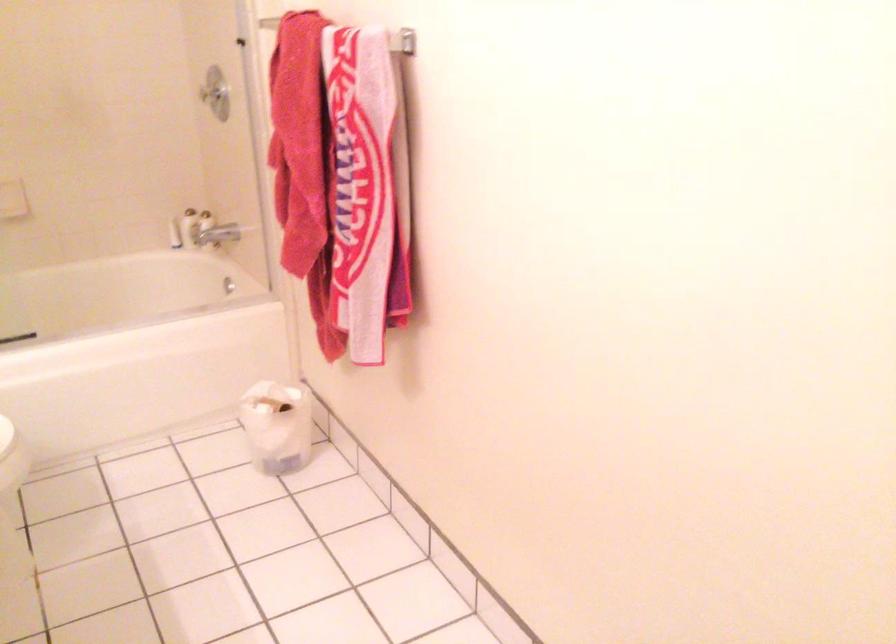
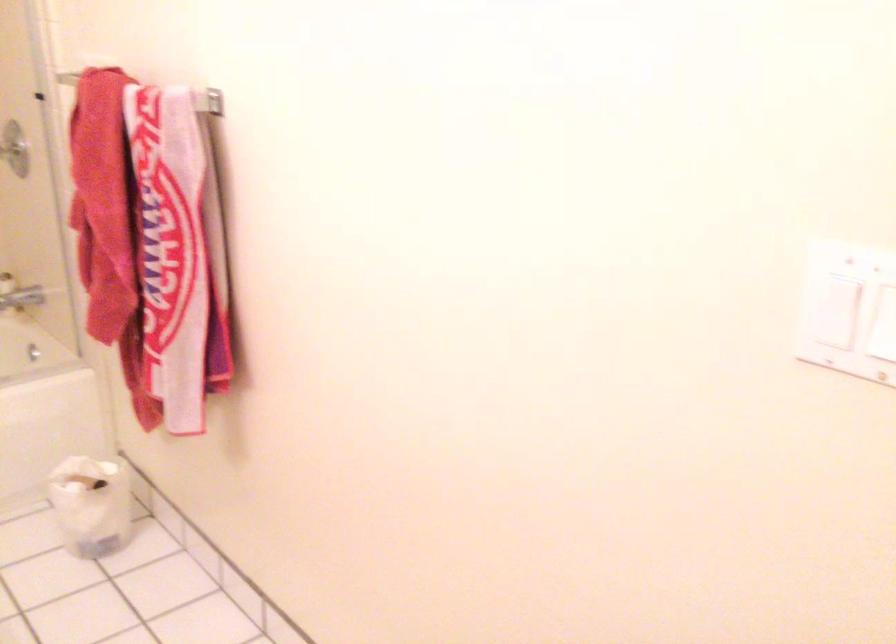
Where in the second image is the point corresponding to the point at 218,234 from the first image?

(20, 299)